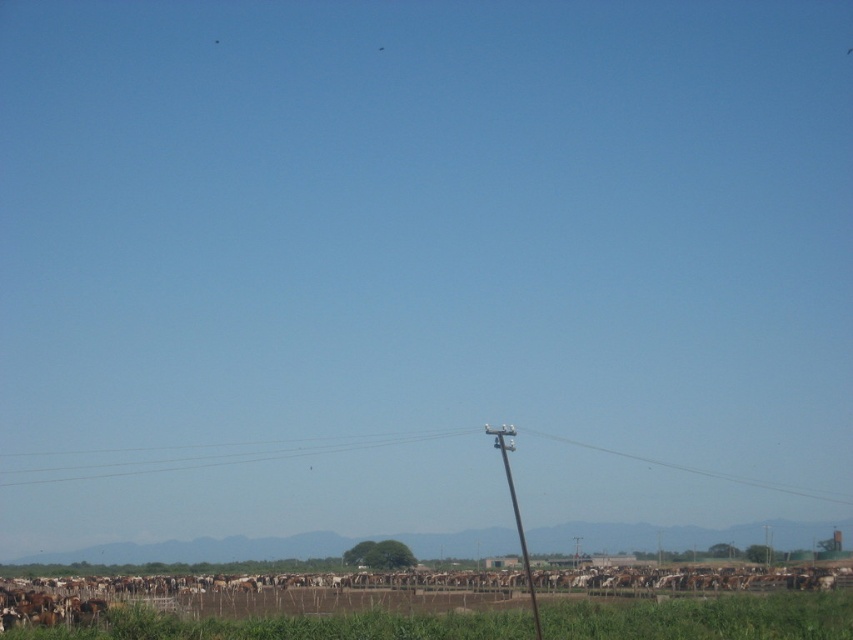
Question: Does smooth wire at center appear under brown wooden telegraph pole at center?

Choices:
 (A) yes
 (B) no

Answer: (A)

Question: Among these objects, which one is nearest to the camera?

Choices:
 (A) green grass at lower center
 (B) brown wooden telegraph pole at center
 (C) smooth wire at center

Answer: (B)

Question: Based on their relative distances, which object is farther from the brown wooden telegraph pole at center?

Choices:
 (A) green grass at lower center
 (B) smooth wire at center

Answer: (B)

Question: Which object appears farthest from the camera in this image?

Choices:
 (A) smooth wire at center
 (B) brown wooden telegraph pole at center

Answer: (A)

Question: Can you confirm if green grass at lower center is positioned to the left of brown wooden telegraph pole at center?

Choices:
 (A) no
 (B) yes

Answer: (A)

Question: In this image, where is green grass at lower center located relative to smooth wire at center?

Choices:
 (A) below
 (B) above

Answer: (B)